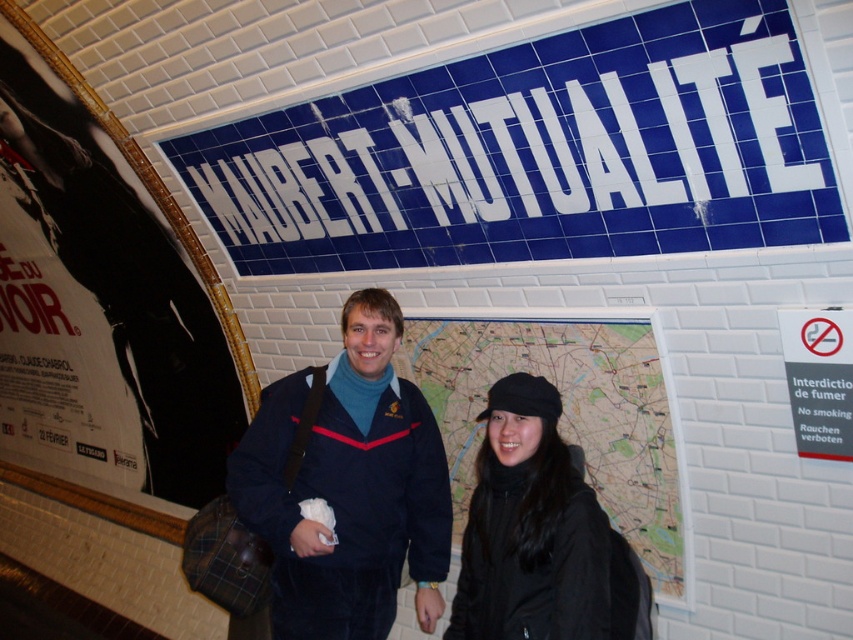
Question: Does velvet blue jacket at center appear over black matte hat at center?

Choices:
 (A) yes
 (B) no

Answer: (A)

Question: Which point is farther to the camera?

Choices:
 (A) (566, 449)
 (B) (242, 458)
 (C) (149, 440)

Answer: (C)

Question: Does white paper poster at left have a lesser width compared to black matte hat at center?

Choices:
 (A) yes
 (B) no

Answer: (B)

Question: Which point is closer to the camera?

Choices:
 (A) (372, 378)
 (B) (563, 532)

Answer: (B)

Question: Which object is the farthest from the white paper poster at left?

Choices:
 (A) velvet blue jacket at center
 (B) blue tile sign at upper center
 (C) black matte hat at center

Answer: (C)

Question: Where is blue tile sign at upper center located in relation to white paper poster at left in the image?

Choices:
 (A) above
 (B) below

Answer: (A)